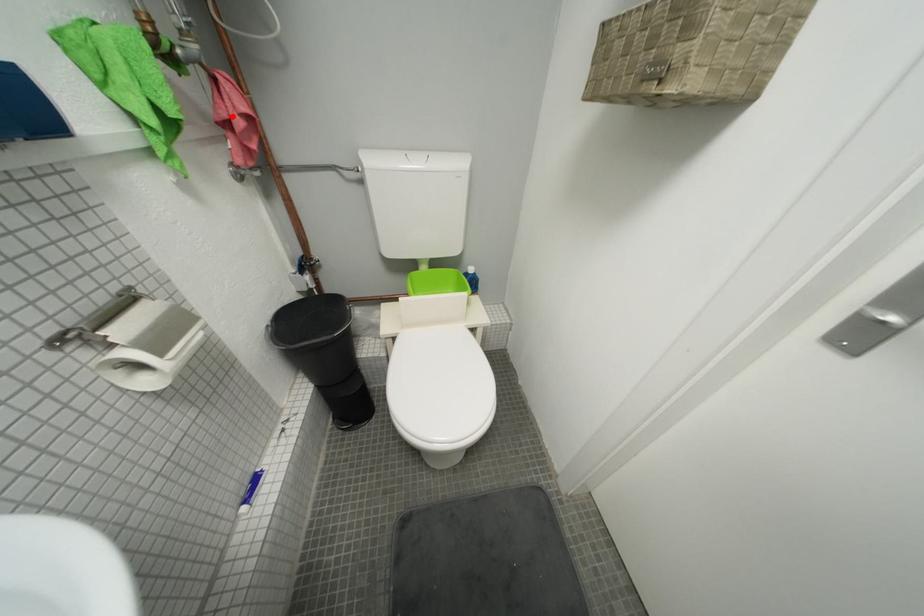
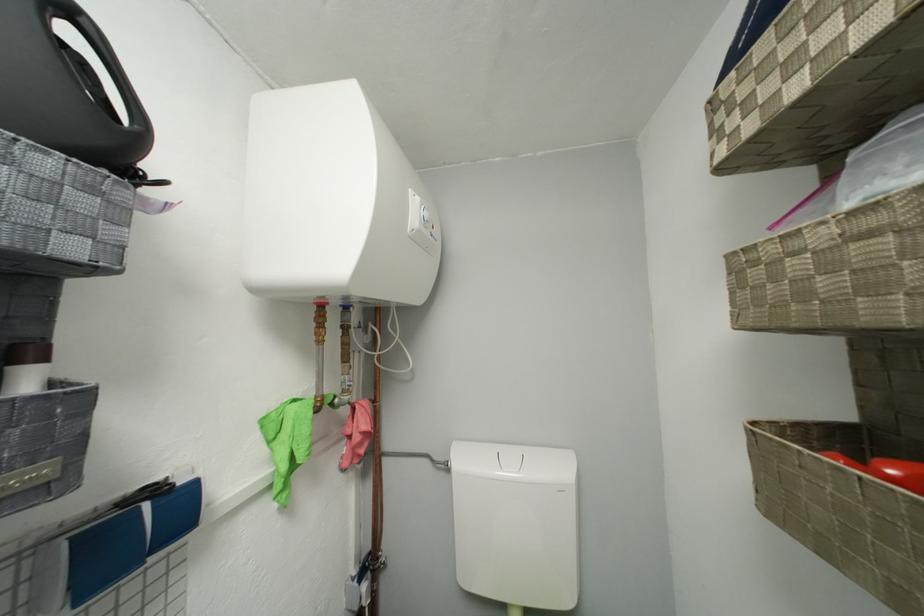
Question: I am providing you with two images of the same scene from different viewpoints. A red point is marked on the first image. At the location where the point appears in image 1, is it still visible in image 2?

Choices:
 (A) Yes
 (B) No

Answer: (A)